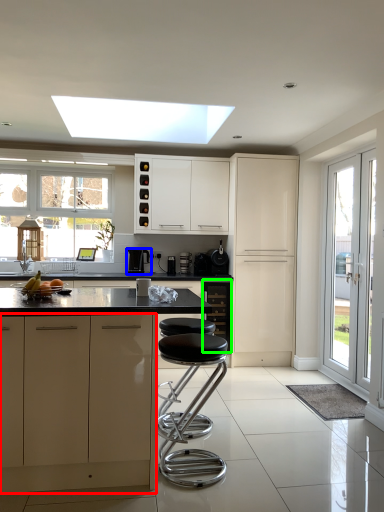
Question: Based on their relative distances, which object is farther from cabinetry (highlighted by a red box)? Choose from kitchen appliance (highlighted by a blue box) and cabinetry (highlighted by a green box).

Choices:
 (A) kitchen appliance
 (B) cabinetry

Answer: (A)